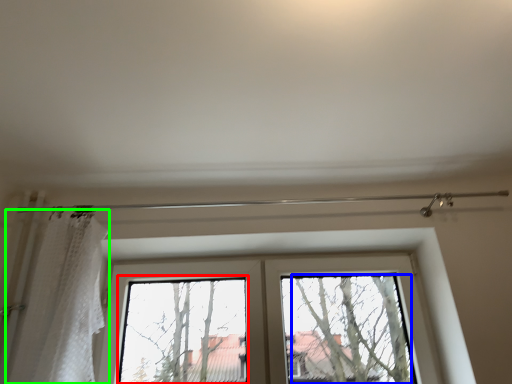
Question: Which object is the farthest from bay window (highlighted by a red box)? Choose among these: tree (highlighted by a blue box) or shower curtain (highlighted by a green box).

Choices:
 (A) tree
 (B) shower curtain

Answer: (A)